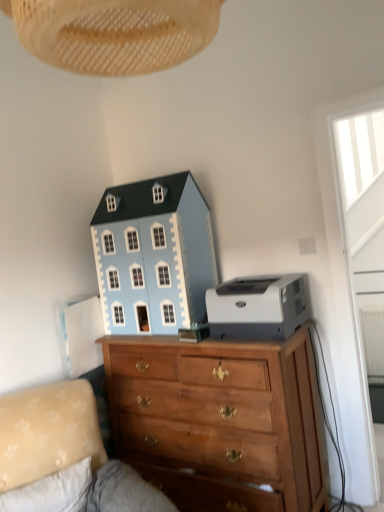
Question: Could you tell me if light blue painted wood dollhouse at upper center is facing woven beige lampshade at upper center?

Choices:
 (A) yes
 (B) no

Answer: (B)

Question: Is light blue painted wood dollhouse at upper center completely or partially outside of woven beige lampshade at upper center?

Choices:
 (A) no
 (B) yes

Answer: (B)

Question: Considering the relative positions of light blue painted wood dollhouse at upper center and woven beige lampshade at upper center in the image provided, is light blue painted wood dollhouse at upper center in front of woven beige lampshade at upper center?

Choices:
 (A) yes
 (B) no

Answer: (B)

Question: Is light blue painted wood dollhouse at upper center smaller than woven beige lampshade at upper center?

Choices:
 (A) no
 (B) yes

Answer: (A)

Question: Does light blue painted wood dollhouse at upper center contain woven beige lampshade at upper center?

Choices:
 (A) yes
 (B) no

Answer: (B)

Question: In terms of width, does white plastic printer at right look wider or thinner when compared to wooden chest of drawers at center?

Choices:
 (A) wide
 (B) thin

Answer: (B)

Question: From the image's perspective, is white plastic printer at right positioned above or below wooden chest of drawers at center?

Choices:
 (A) below
 (B) above

Answer: (B)

Question: Is white plastic printer at right to the left or to the right of wooden chest of drawers at center in the image?

Choices:
 (A) right
 (B) left

Answer: (A)

Question: From a real-world perspective, is white plastic printer at right above or below wooden chest of drawers at center?

Choices:
 (A) above
 (B) below

Answer: (A)

Question: Considering the positions of woven beige lampshade at upper center and light blue painted wood dollhouse at upper center in the image, is woven beige lampshade at upper center wider or thinner than light blue painted wood dollhouse at upper center?

Choices:
 (A) wide
 (B) thin

Answer: (A)

Question: From the image's perspective, relative to light blue painted wood dollhouse at upper center, is woven beige lampshade at upper center above or below?

Choices:
 (A) below
 (B) above

Answer: (B)

Question: Considering their positions, is woven beige lampshade at upper center located in front of or behind light blue painted wood dollhouse at upper center?

Choices:
 (A) front
 (B) behind

Answer: (A)

Question: Is woven beige lampshade at upper center inside the boundaries of light blue painted wood dollhouse at upper center, or outside?

Choices:
 (A) inside
 (B) outside

Answer: (B)

Question: Considering the positions of wooden chest of drawers at center and light blue painted wood dollhouse at upper center in the image, is wooden chest of drawers at center wider or thinner than light blue painted wood dollhouse at upper center?

Choices:
 (A) wide
 (B) thin

Answer: (A)

Question: From a real-world perspective, is wooden chest of drawers at center physically located above or below light blue painted wood dollhouse at upper center?

Choices:
 (A) below
 (B) above

Answer: (A)